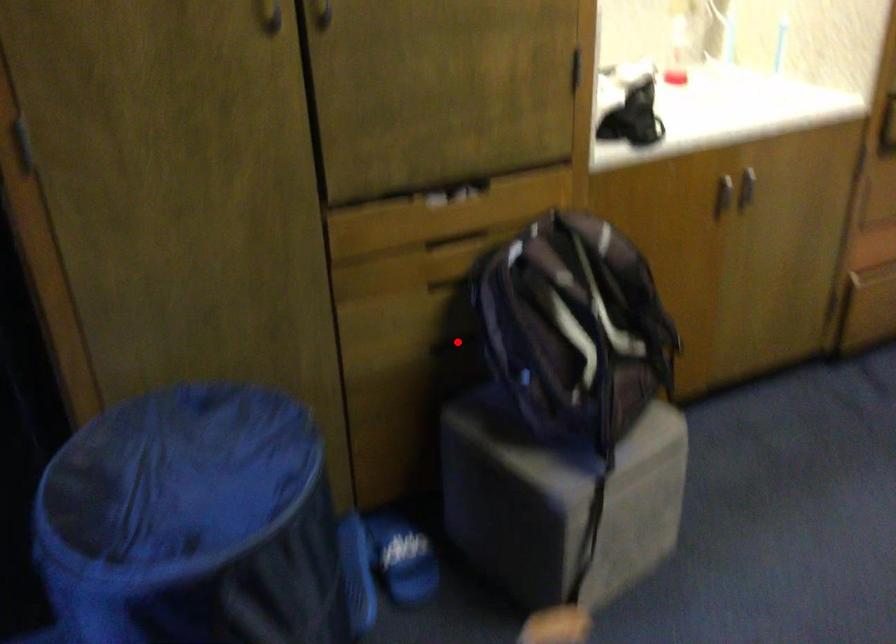
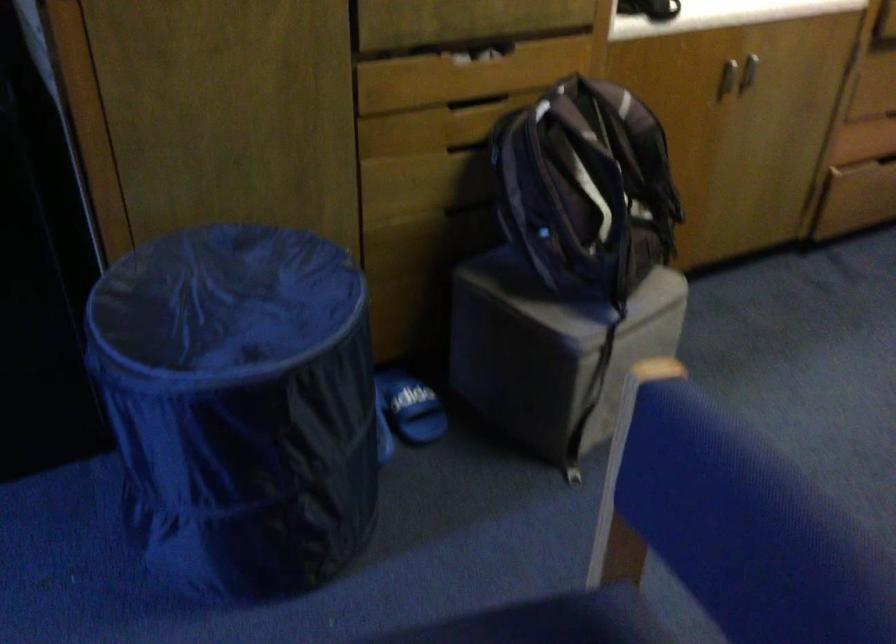
Locate, in the second image, the point that corresponds to the highlighted location in the first image.

(467, 205)